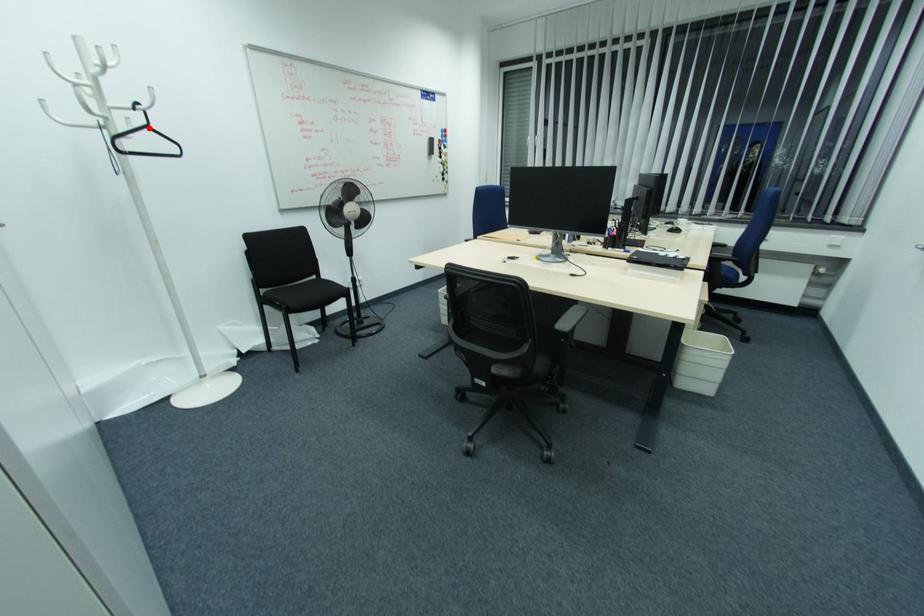
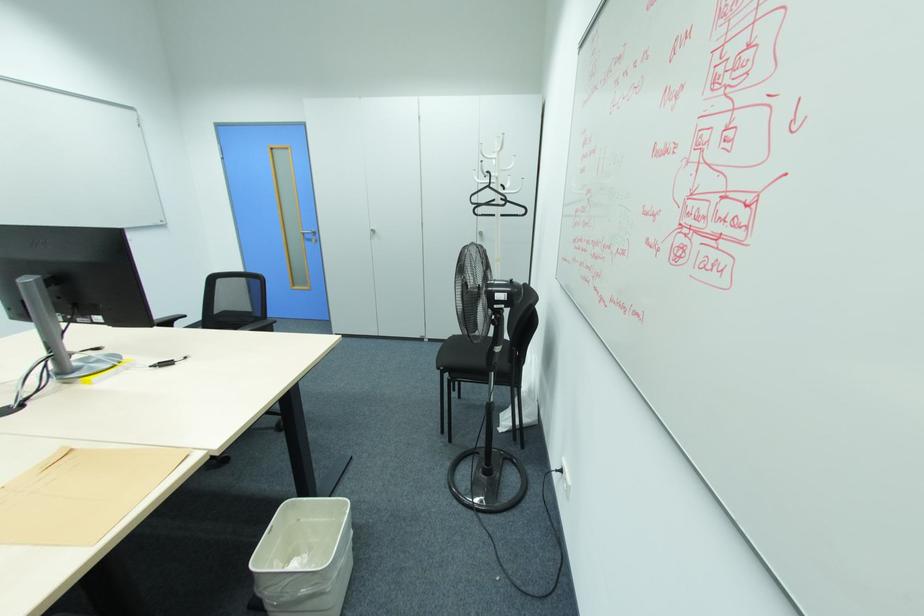
Question: A red point is marked in image1. In image2, is the corresponding 3D point closer to the camera or farther? Reply with the corresponding letter.

Choices:
 (A) The corresponding 3D point is closer.
 (B) The corresponding 3D point is farther.

Answer: (A)